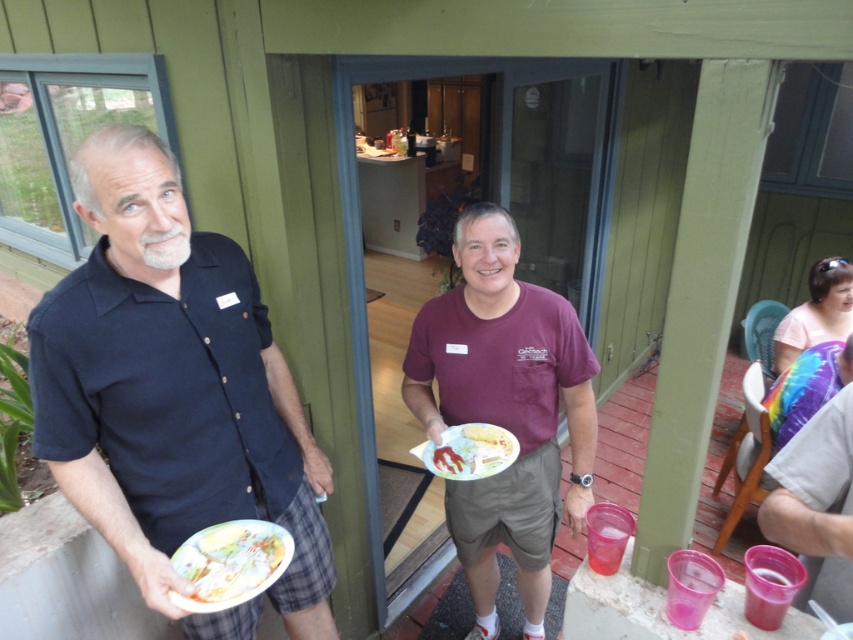
Question: Which object is the farthest from the matte black shirt at left?

Choices:
 (A) white cotton shirt at right
 (B) yellow matte plate at center

Answer: (A)

Question: Is maroon fabric shirt at center wider than white cotton shirt at right?

Choices:
 (A) yes
 (B) no

Answer: (A)

Question: Estimate the real-world distances between objects in this image. Which object is closer to the yellow matte plate at center?

Choices:
 (A) yellowish matte corn cob at center
 (B) white cotton shirt at right
 (C) rainbow fabric shirt at right
 (D) matte black shirt at left

Answer: (A)

Question: Does yellowish matte corn cob at center appear under yellow matte plate at center?

Choices:
 (A) yes
 (B) no

Answer: (A)

Question: Which point is farther to the camera?

Choices:
 (A) (199, 296)
 (B) (498, 429)
 (C) (840, 305)

Answer: (C)

Question: Can you confirm if maroon fabric shirt at center is wider than yellowish matte corn cob at center?

Choices:
 (A) yes
 (B) no

Answer: (A)